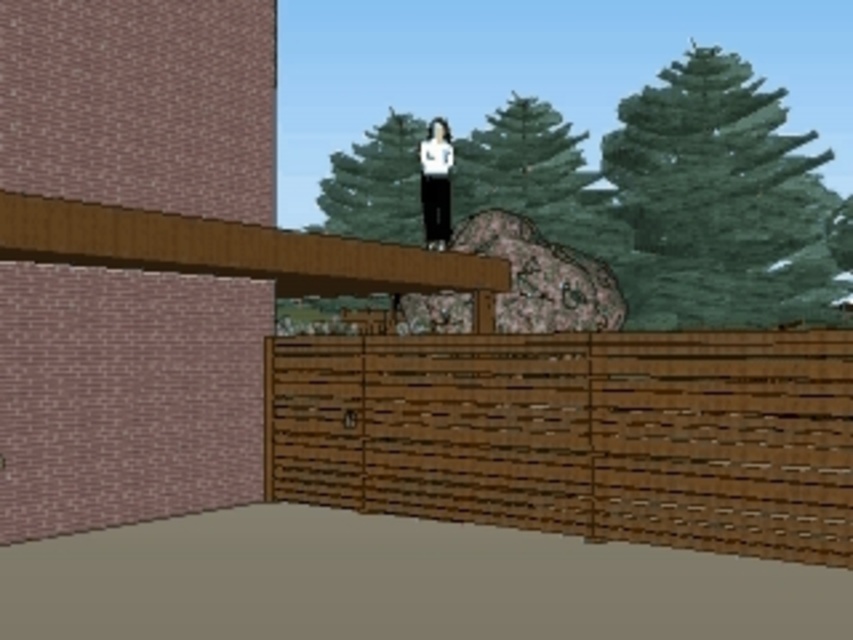
Question: Which point appears closest to the camera in this image?

Choices:
 (A) tap(508, 259)
 (B) tap(428, 202)

Answer: (B)

Question: Where is rustic stone at center located in relation to white matte pants at center in the image?

Choices:
 (A) below
 (B) above

Answer: (A)

Question: Which point is farther to the camera?

Choices:
 (A) (302, 500)
 (B) (440, 157)

Answer: (B)

Question: Can you confirm if brown wooden fence at center is positioned above white matte pants at center?

Choices:
 (A) no
 (B) yes

Answer: (A)

Question: Which point appears farthest from the camera in this image?

Choices:
 (A) (531, 451)
 (B) (607, 301)
 (C) (445, 140)

Answer: (B)

Question: Is brown wooden fence at center above white matte pants at center?

Choices:
 (A) no
 (B) yes

Answer: (A)